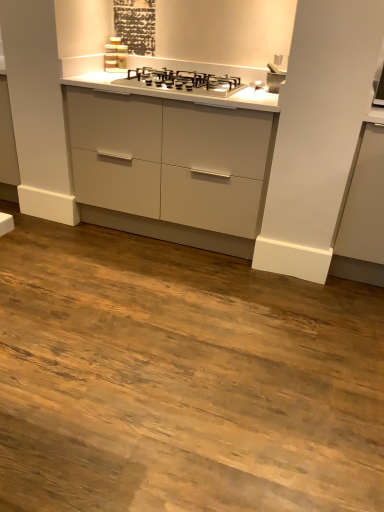
Question: Is point (215, 84) positioned closer to the camera than point (339, 252)?

Choices:
 (A) closer
 (B) farther

Answer: (A)

Question: Which is correct: satin silver gas stove at center is inside matte gray cabinet at right, or outside of it?

Choices:
 (A) inside
 (B) outside

Answer: (B)

Question: Based on their relative distances, which object is farther from the satin silver faucet at upper right?

Choices:
 (A) matte gray cabinet at right
 (B) satin silver gas stove at center

Answer: (A)

Question: Which object is positioned farthest from the satin silver faucet at upper right?

Choices:
 (A) matte gray cabinet at right
 (B) satin silver gas stove at center

Answer: (A)